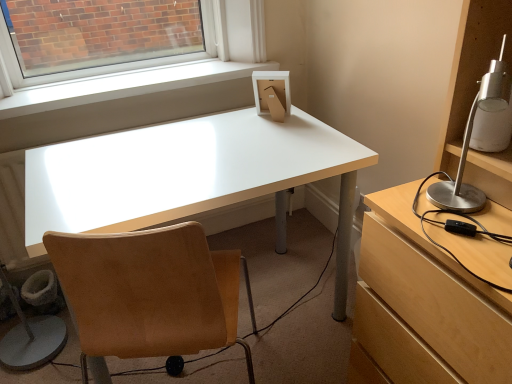
At what (x,y) coordinates should I click in order to perform the action: click on vacant area on top of white glossy desk at center (from a real-world perspective). Please return your answer as a coordinate pair (x, y). Looking at the image, I should click on (184, 158).